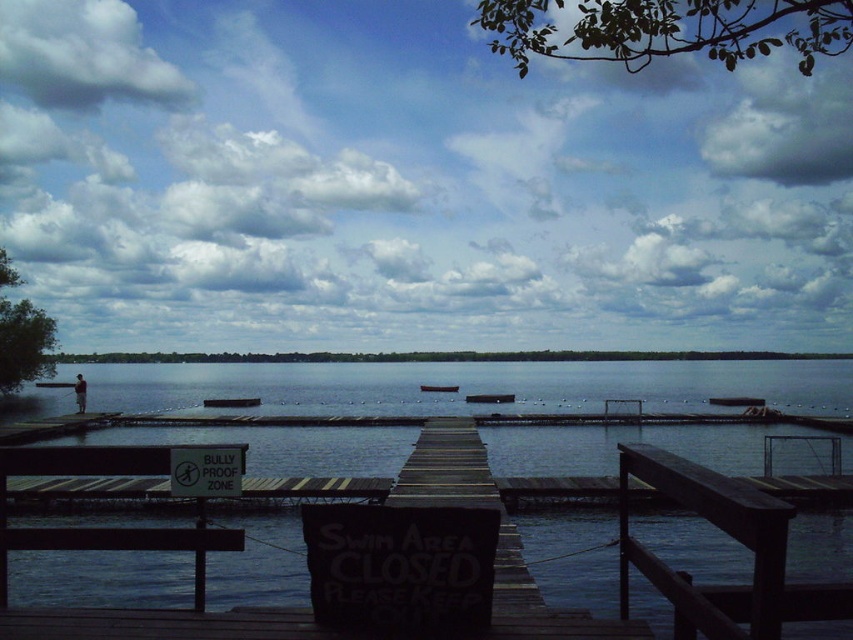
Question: Which is nearer to the brown wooden boat at center?

Choices:
 (A) white plastic sign at center
 (B) wooden dock at center
 (C) dark gray wooden dock at center
 (D) dark wood dock at center

Answer: (B)

Question: Which point appears closest to the camera in this image?

Choices:
 (A) (202, 401)
 (B) (486, 397)

Answer: (A)

Question: Can you confirm if dark gray plastic boat at center is positioned above brown wooden boat at center?

Choices:
 (A) no
 (B) yes

Answer: (B)

Question: Is white plastic sign at center bigger than brown wooden boat at center?

Choices:
 (A) no
 (B) yes

Answer: (A)

Question: Does dark gray plastic boat at center appear on the right side of brown wooden boat at center?

Choices:
 (A) yes
 (B) no

Answer: (A)

Question: Among these points, which one is farthest from the camera?

Choices:
 (A) (434, 390)
 (B) (717, 400)

Answer: (A)